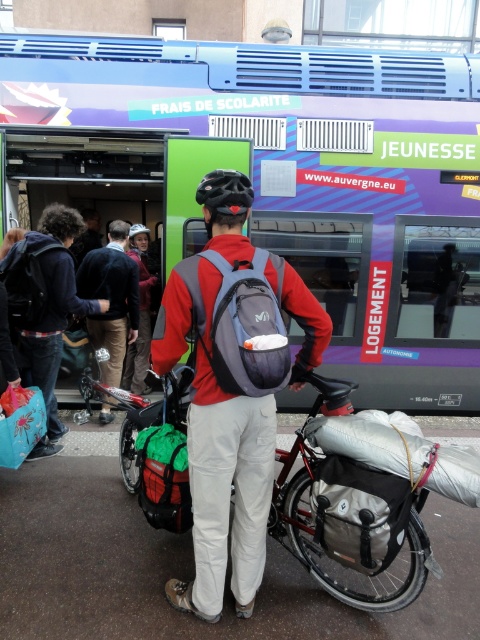
Question: Which object is the farthest from the matte gray backpack at center?

Choices:
 (A) green fabric bag at center
 (B) gray fabric bag at center
 (C) dark blue backpack at left

Answer: (C)

Question: Can you confirm if dark blue backpack at left is positioned to the right of gray fabric backpack at center?

Choices:
 (A) yes
 (B) no

Answer: (B)

Question: Which point appears farthest from the camera in this image?

Choices:
 (A) (22, 435)
 (B) (278, 534)
 (C) (31, 352)

Answer: (C)

Question: Is matte gray backpack at center wider than brushed metal helmet at upper center?

Choices:
 (A) yes
 (B) no

Answer: (A)

Question: Is gray fabric bag at center smaller than green fabric bag at center?

Choices:
 (A) no
 (B) yes

Answer: (B)

Question: Which is nearer to the green fabric bag at center?

Choices:
 (A) matte gray backpack at center
 (B) black matte bicycle helmet at center
 (C) dark blue backpack at left
 (D) blue metallic train at center

Answer: (A)